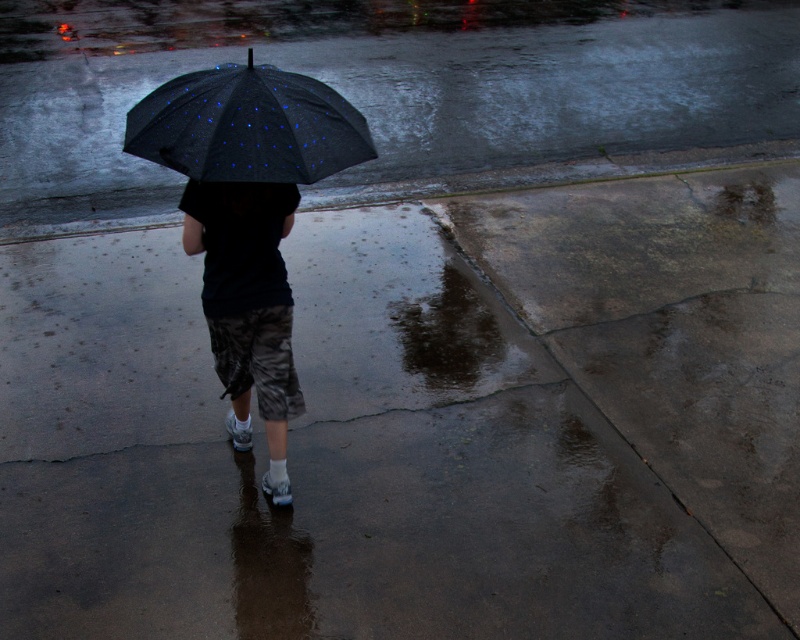
You are observing a person walking in the rain. You notice the camouflage shorts at center and the black matte umbrella at center. Which object appears taller in the image?

The camouflage shorts at center appears taller than the black matte umbrella at center in the image.

You are standing in the rainy evening scene. You see the black matte umbrella at center and the glossy concrete puddle at lower center. Which object is higher in position?

The black matte umbrella at center is located above the glossy concrete puddle at lower center, so it is higher in position.

You are a photographer trying to capture the reflection of the black matte umbrella at center in the glossy concrete puddle at lower center. Can you confirm if the umbrella will fit entirely within the puddle?

The black matte umbrella at center is smaller than the glossy concrete puddle at lower center, so yes, the umbrella will fit entirely within the puddle.